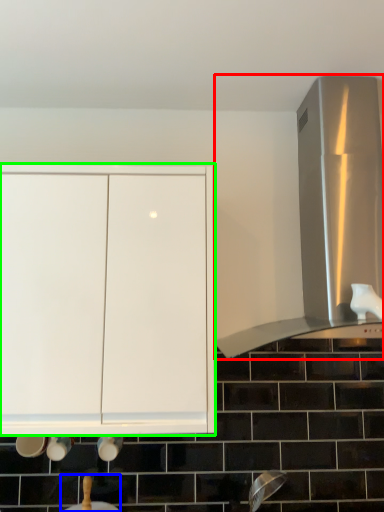
Question: Which is nearer to the vent (highlighted by a red box)? sink (highlighted by a blue box) or cabinetry (highlighted by a green box).

Choices:
 (A) sink
 (B) cabinetry

Answer: (B)